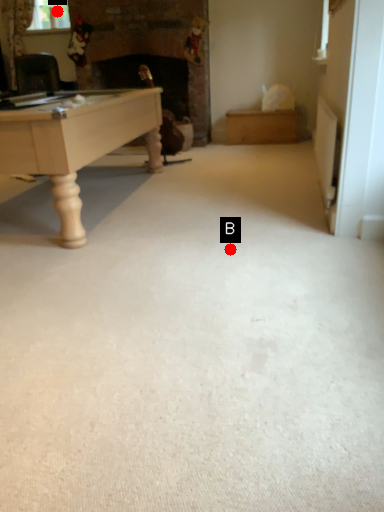
Question: Two points are circled on the image, labeled by A and B beside each circle. Which point is further to the camera?

Choices:
 (A) A is further
 (B) B is further

Answer: (A)